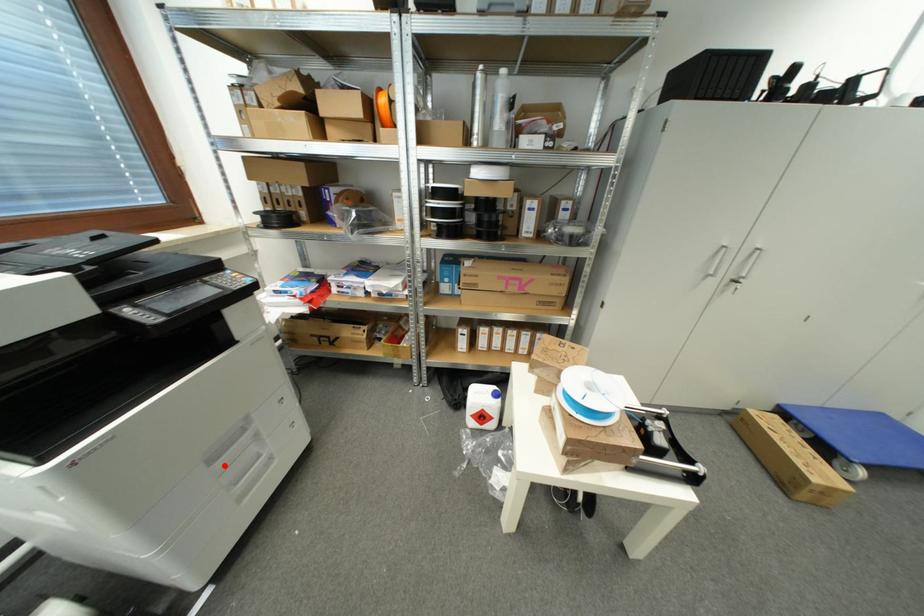
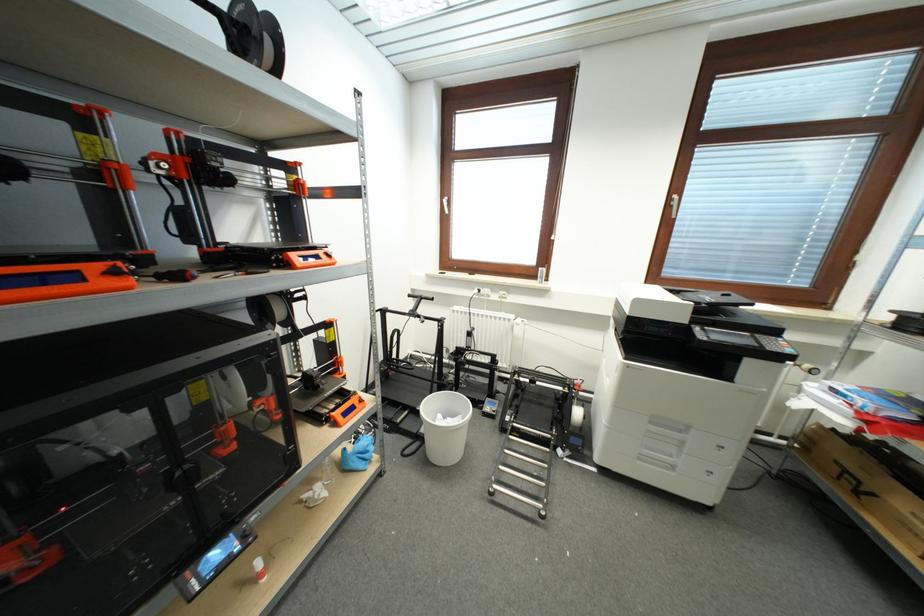
Where in the second image is the point corresponding to the highlighted location from the first image?

(658, 431)